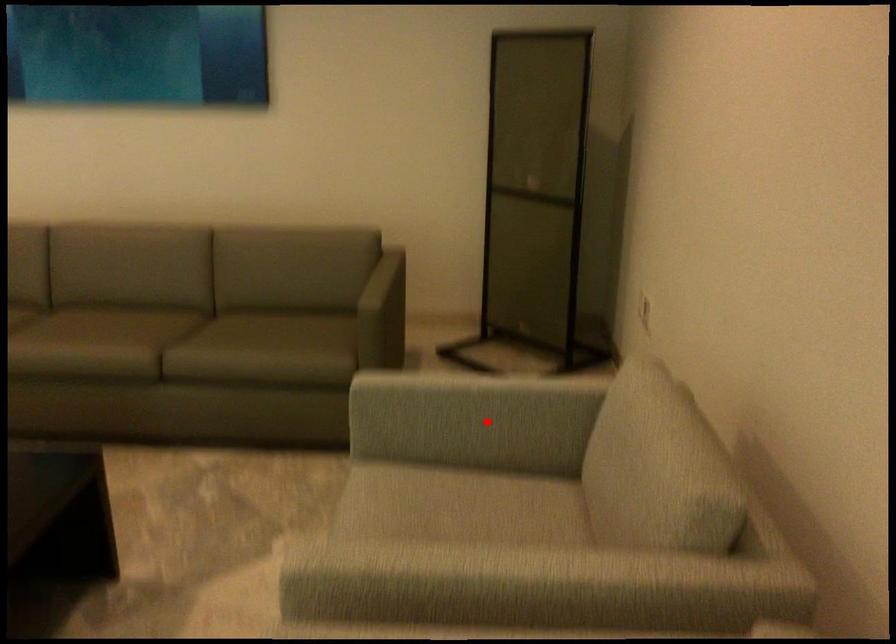
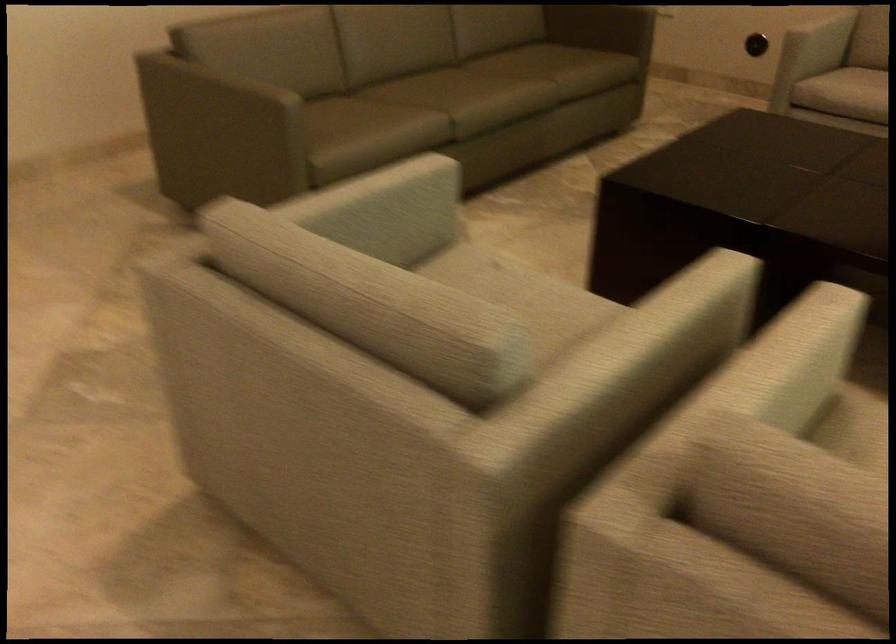
Question: I am providing you with two images of the same scene from different viewpoints. Image1 has a red point marked. In image2, the corresponding 3D location appears at what relative position? Reply with the corresponding letter.

Choices:
 (A) Closer
 (B) Farther

Answer: (B)